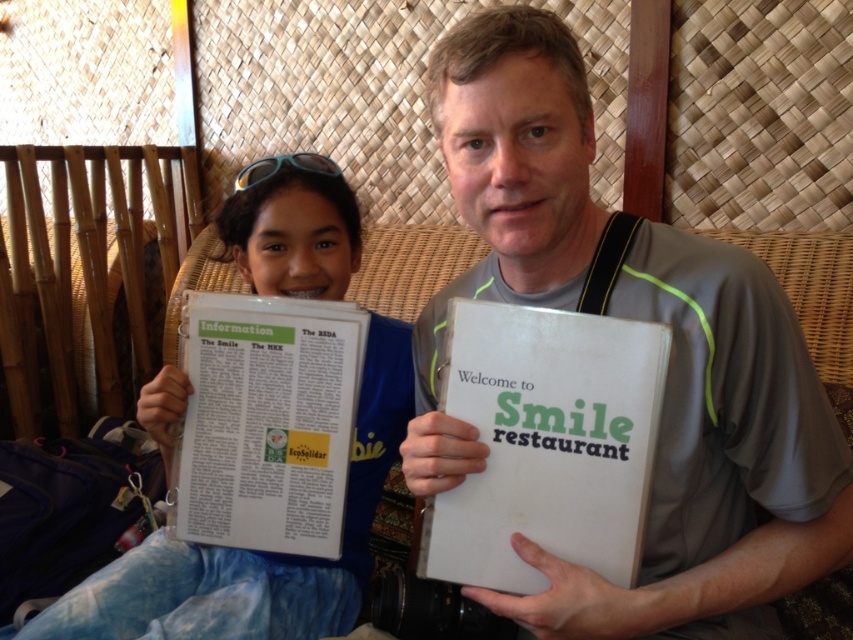
Does blue tie-dye pants at lower left have a greater width compared to white paper information sheet at center?

Yes.

You are a GUI agent. You are given a task and a screenshot of the screen. Output one action in this format:
    pyautogui.click(x=<x>, y=<y>)
    Task: Click on the blue tie-dye pants at lower left
    
    Given the screenshot: What is the action you would take?
    pyautogui.click(x=253, y=550)

Which is in front, point (357, 257) or point (352, 413)?

Point (352, 413)

What are the coordinates of `blue tie-dye pants at lower left` in the screenshot? It's located at (253, 550).

Does white paper menu at center have a larger size compared to white paper at center?

Yes, white paper menu at center is bigger than white paper at center.

Where is `white paper menu at center`? white paper menu at center is located at coordinates pyautogui.click(x=668, y=362).

Find the location of a particular element. The width and height of the screenshot is (853, 640). white paper menu at center is located at coordinates (668, 362).

What do you see at coordinates (546, 442) in the screenshot?
I see `white paper at center` at bounding box center [546, 442].

Between point (579, 504) and point (314, 588), which one is positioned in front?

Point (579, 504)

The image size is (853, 640). Identify the location of white paper at center. (546, 442).